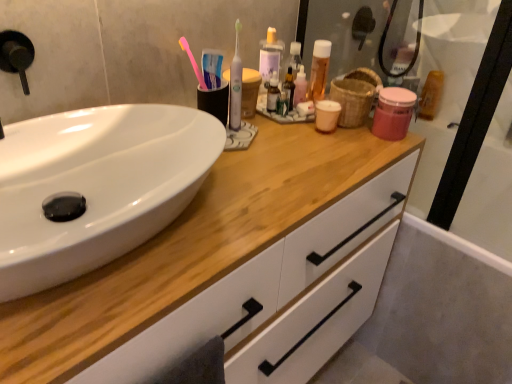
Where is `vacant area that is situated to the right of white glossy toothbrush at center, which is counted as the 1th toothbrush, starting from the right`? vacant area that is situated to the right of white glossy toothbrush at center, which is counted as the 1th toothbrush, starting from the right is located at coordinates (302, 141).